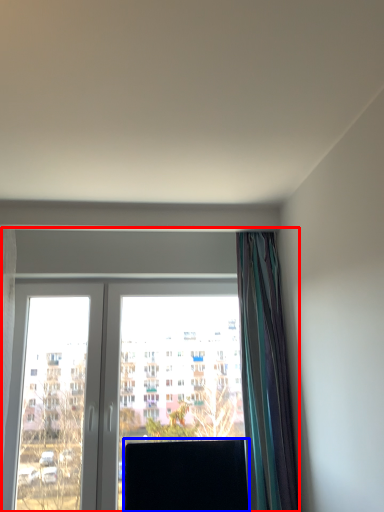
Question: Which object appears farthest to the camera in this image, window (highlighted by a red box) or window screen (highlighted by a blue box)?

Choices:
 (A) window
 (B) window screen

Answer: (A)